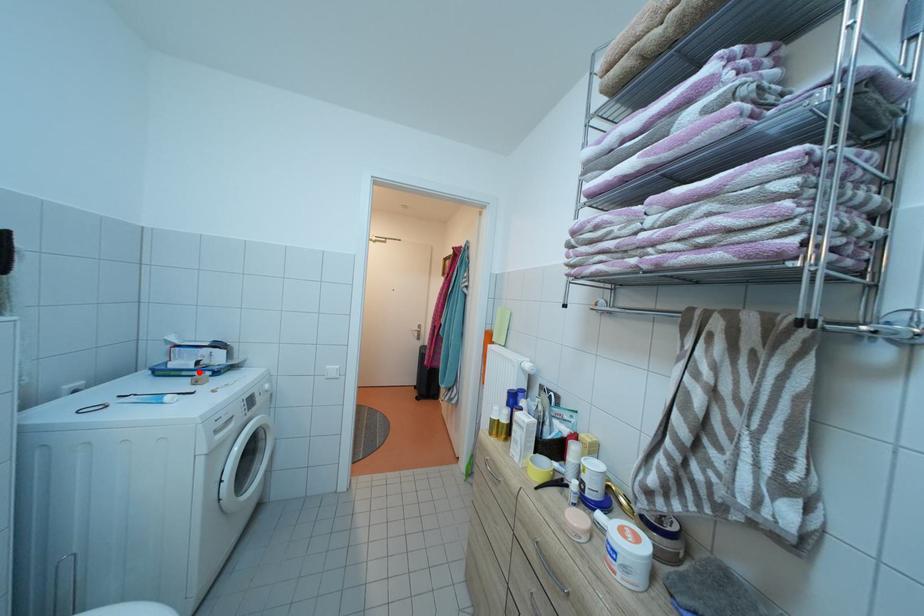
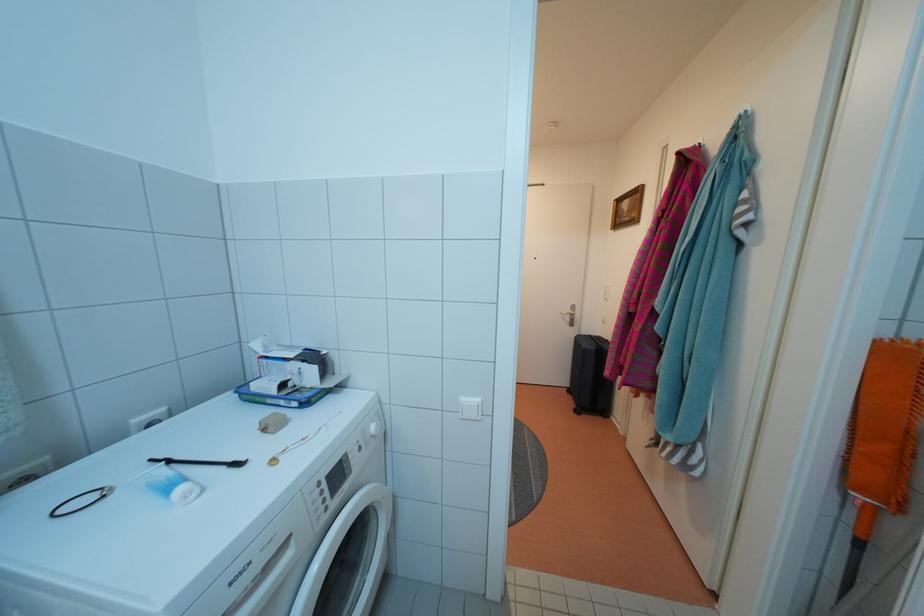
Locate, in the second image, the point that corresponds to the highlighted location in the first image.

(282, 398)